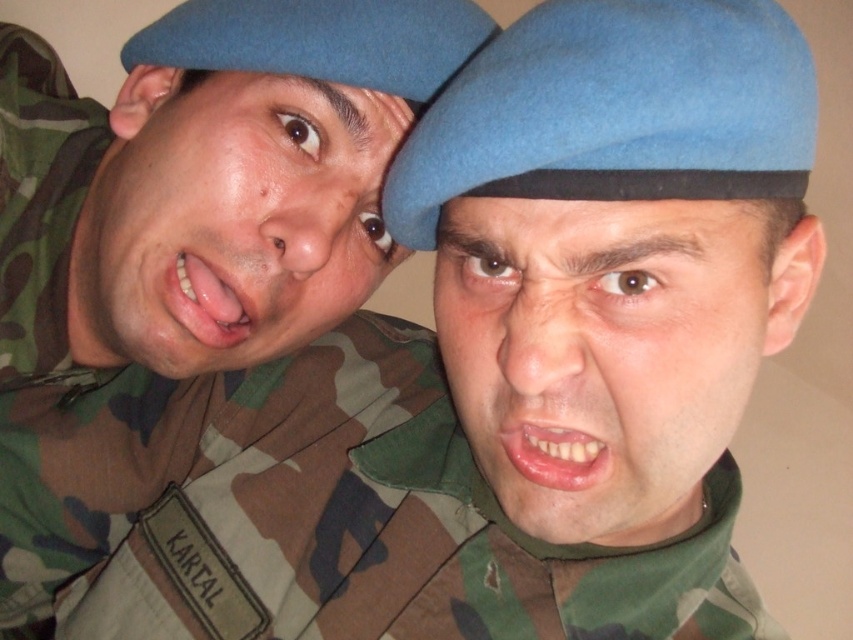
Question: Which of the following is the closest to the observer?

Choices:
 (A) (579, 342)
 (B) (230, 333)
 (C) (274, 340)

Answer: (A)

Question: Based on their relative distances, which object is farther from the matte green uniform at left?

Choices:
 (A) matte green face at center
 (B) camo fabric uniform at left

Answer: (A)

Question: Does camo fabric uniform at left have a larger size compared to pink glossy lips at center?

Choices:
 (A) yes
 (B) no

Answer: (A)

Question: Which point is farther from the camera taking this photo?

Choices:
 (A) (517, 467)
 (B) (15, 506)
 (C) (363, 179)

Answer: (B)

Question: Is matte green face at center thinner than pink glossy tongue at center?

Choices:
 (A) no
 (B) yes

Answer: (A)

Question: Is matte green uniform at left to the left of pink glossy tongue at center from the viewer's perspective?

Choices:
 (A) yes
 (B) no

Answer: (A)